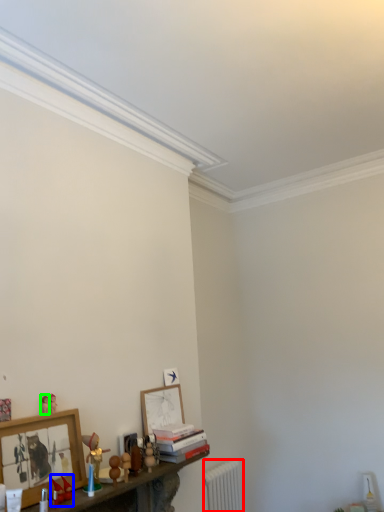
Question: Which object is positioned farthest from radiator (highlighted by a red box)? Select from toy (highlighted by a blue box) and toy (highlighted by a green box).

Choices:
 (A) toy
 (B) toy

Answer: (B)